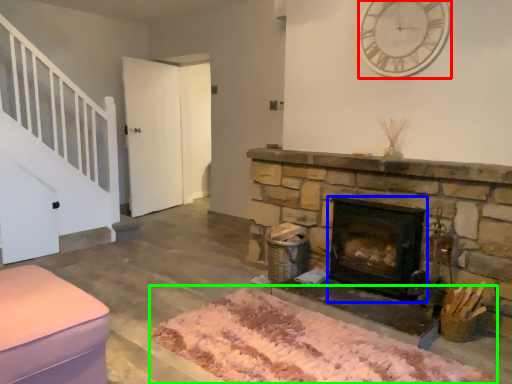
Question: Which object is positioned closest to clock (highlighted by a red box)? Select from wood burning stove (highlighted by a blue box) and mat (highlighted by a green box).

Choices:
 (A) wood burning stove
 (B) mat

Answer: (A)